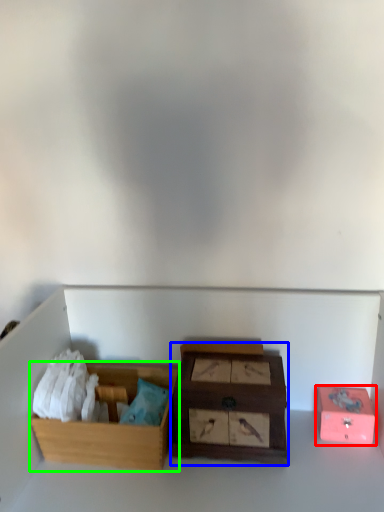
Question: Considering the real-world distances, which object is closest to box (highlighted by a red box)? box (highlighted by a blue box) or box (highlighted by a green box).

Choices:
 (A) box
 (B) box

Answer: (A)